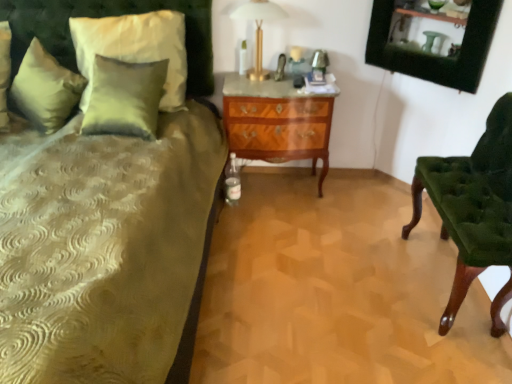
Identify the location of blank space above mahogany wood drawer at center (from a real-world perspective). Image resolution: width=512 pixels, height=384 pixels. (286, 87).